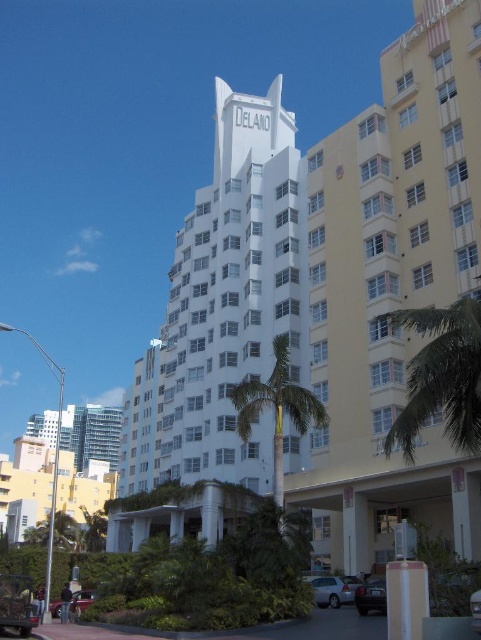
You are standing at the origin point of the coordinate system in the image. Which direction should you move to reach the white smooth building at center?

You should move towards the coordinates point (x=326, y=298) to reach the white smooth building at center.

You are standing at point (331, 589) in the urban scene. What object is located exactly at your current position?

The silver metallic sedan at lower center is located exactly at point (331, 589).